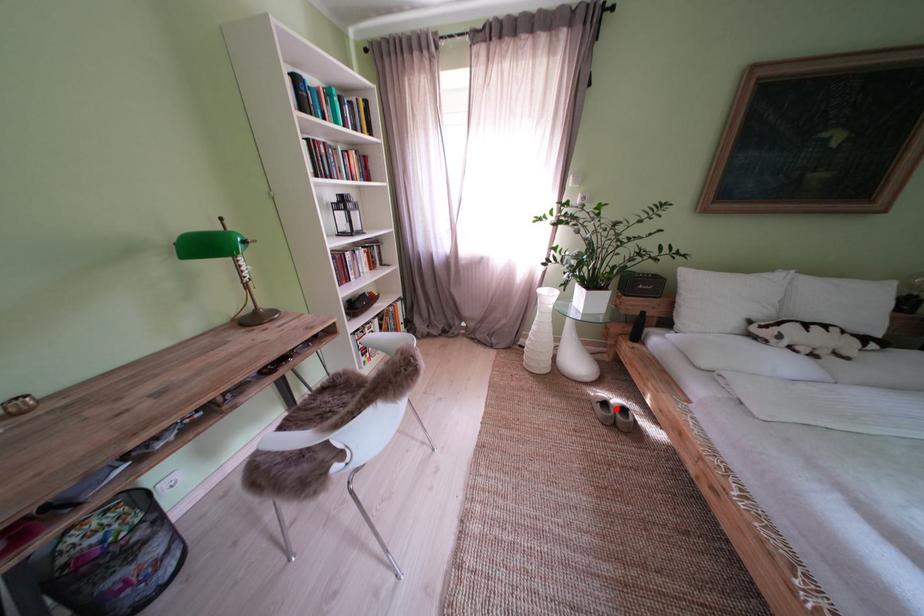
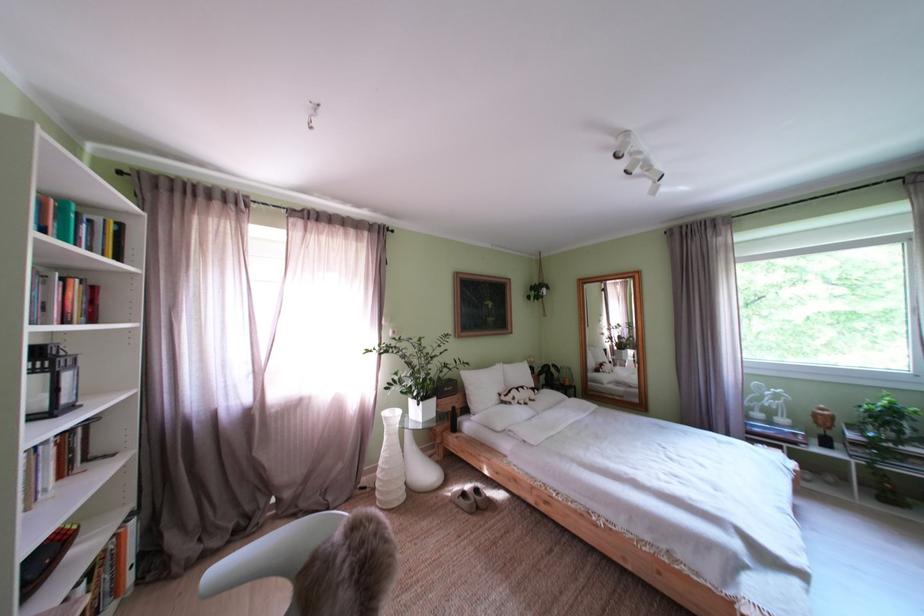
Locate, in the second image, the point that corresponds to the highlighted location in the first image.

(475, 500)